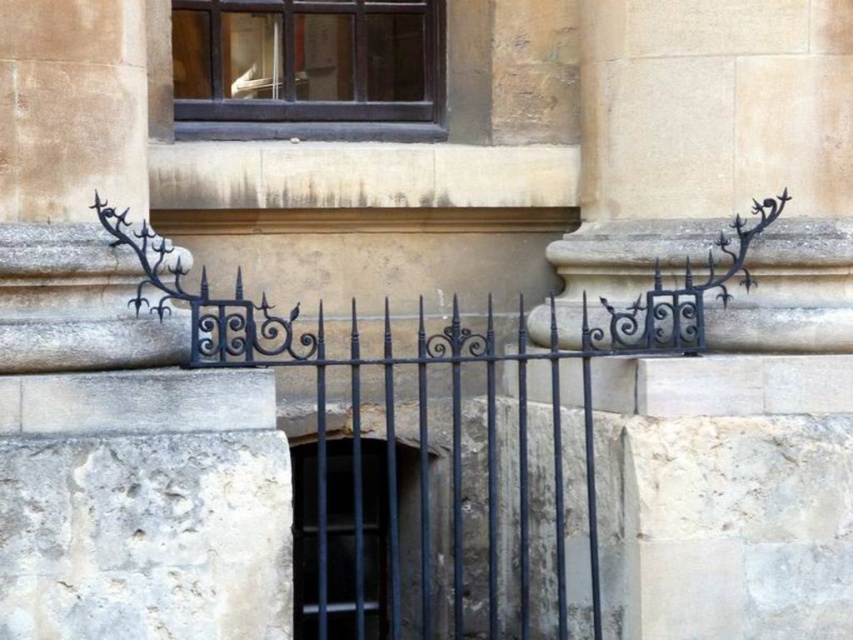
Question: Does dark brown wood window at upper center have a lesser width compared to black metal bars at center?

Choices:
 (A) no
 (B) yes

Answer: (A)

Question: Does dark brown wood window at upper center have a larger size compared to black metal bars at center?

Choices:
 (A) no
 (B) yes

Answer: (A)

Question: Can you confirm if dark brown wood window at upper center is thinner than black metal bars at center?

Choices:
 (A) yes
 (B) no

Answer: (B)

Question: Among these objects, which one is nearest to the camera?

Choices:
 (A) dark brown wood window at upper center
 (B) black metal bars at center

Answer: (B)

Question: Among these objects, which one is nearest to the camera?

Choices:
 (A) black metal bars at center
 (B) dark brown wood window at upper center

Answer: (A)